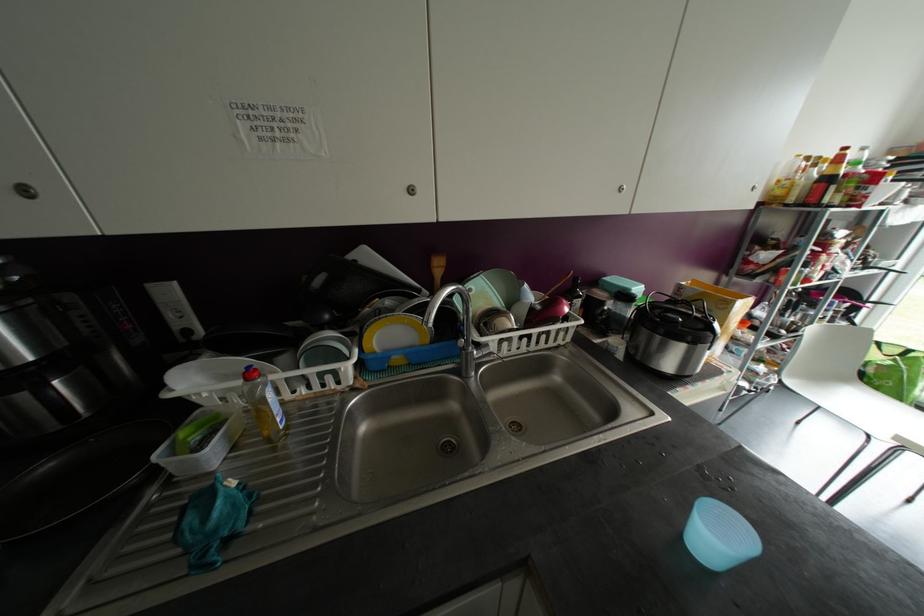
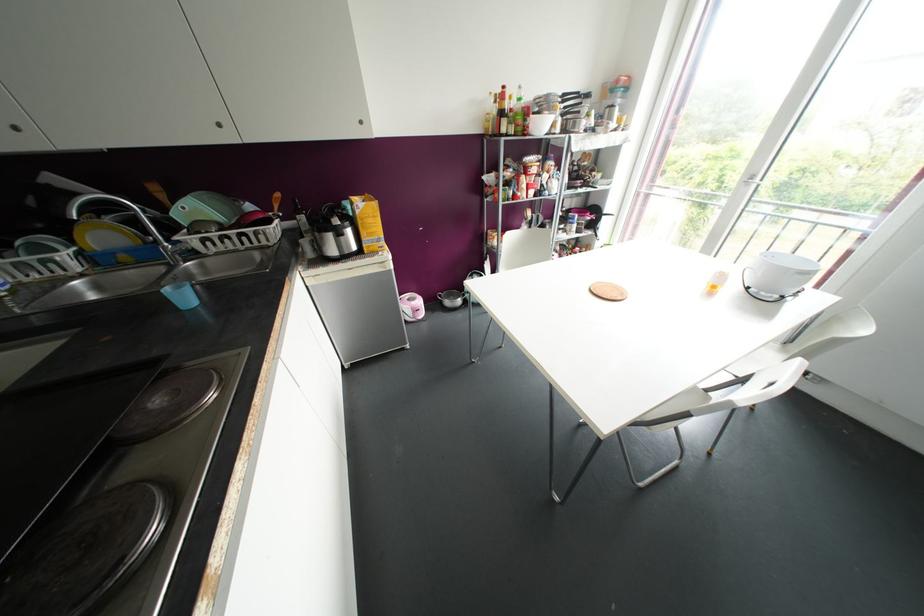
Find the pixel in the second image that matches point 752,188 in the first image.

(360, 122)